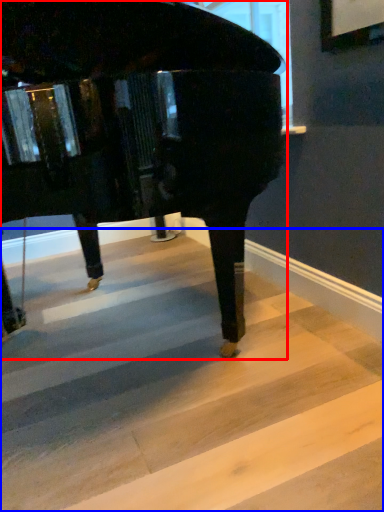
Question: Which object appears farthest to the camera in this image, piano (highlighted by a red box) or stairwell (highlighted by a blue box)?

Choices:
 (A) piano
 (B) stairwell

Answer: (B)